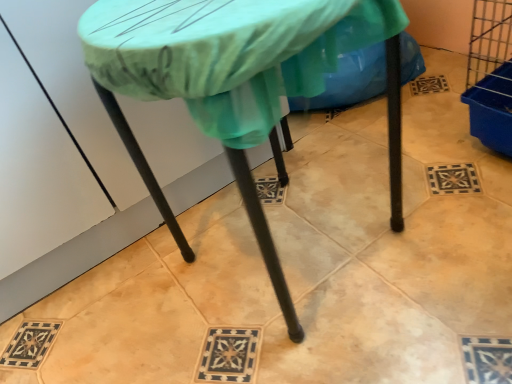
Question: Is matte green tablecloth at center facing towards green fabric at center?

Choices:
 (A) no
 (B) yes

Answer: (A)

Question: Is matte green tablecloth at center surrounding green fabric at center?

Choices:
 (A) no
 (B) yes

Answer: (A)

Question: Is matte green tablecloth at center positioned with its back to green fabric at center?

Choices:
 (A) no
 (B) yes

Answer: (A)

Question: Can you confirm if matte green tablecloth at center is wider than green fabric at center?

Choices:
 (A) yes
 (B) no

Answer: (A)

Question: Does matte green tablecloth at center lie behind green fabric at center?

Choices:
 (A) no
 (B) yes

Answer: (A)

Question: Is matte green tablecloth at center not inside green fabric at center?

Choices:
 (A) no
 (B) yes

Answer: (B)

Question: Is green fabric at center at the left side of matte green tablecloth at center?

Choices:
 (A) yes
 (B) no

Answer: (B)

Question: Considering the relative positions of green fabric at center and matte green tablecloth at center in the image provided, is green fabric at center to the right of matte green tablecloth at center from the viewer's perspective?

Choices:
 (A) no
 (B) yes

Answer: (B)

Question: Can you confirm if green fabric at center is bigger than matte green tablecloth at center?

Choices:
 (A) no
 (B) yes

Answer: (A)

Question: Is green fabric at center further to the viewer compared to matte green tablecloth at center?

Choices:
 (A) no
 (B) yes

Answer: (B)

Question: From the image's perspective, is green fabric at center beneath matte green tablecloth at center?

Choices:
 (A) yes
 (B) no

Answer: (B)

Question: Could you tell me if green fabric at center is turned towards matte green tablecloth at center?

Choices:
 (A) no
 (B) yes

Answer: (A)

Question: Is green fabric at center inside the boundaries of matte green tablecloth at center, or outside?

Choices:
 (A) inside
 (B) outside

Answer: (B)